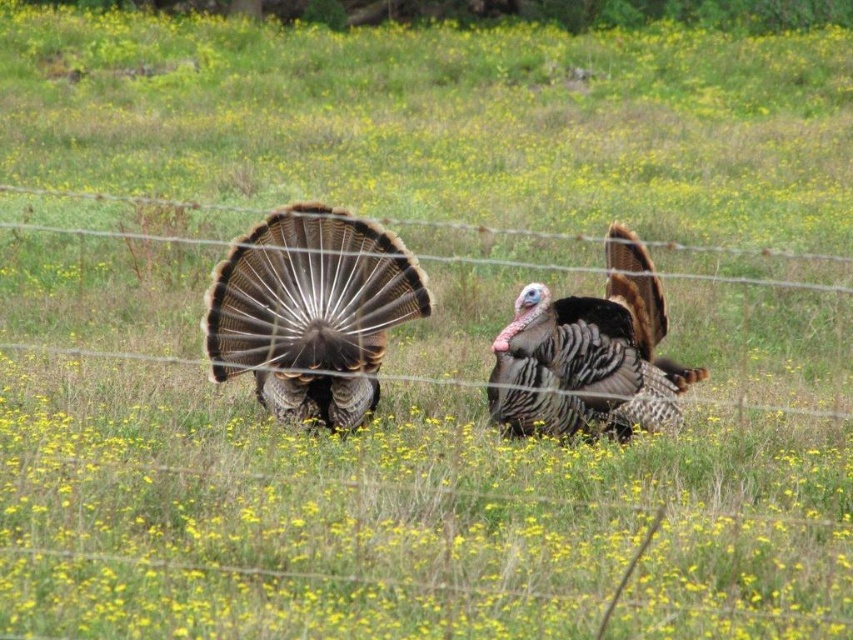
Question: Among these objects, which one is nearest to the camera?

Choices:
 (A) speckled feathered turkey at center
 (B) feathered brown turkey at center

Answer: (B)

Question: Does feathered brown turkey at center appear on the right side of speckled feathered turkey at center?

Choices:
 (A) no
 (B) yes

Answer: (A)

Question: Is feathered brown turkey at center to the left of speckled feathered turkey at center from the viewer's perspective?

Choices:
 (A) no
 (B) yes

Answer: (B)

Question: Which point is farther to the camera?

Choices:
 (A) speckled feathered turkey at center
 (B) feathered brown turkey at center

Answer: (A)

Question: Which point is farther from the camera taking this photo?

Choices:
 (A) (656, 301)
 (B) (241, 314)

Answer: (A)

Question: Is feathered brown turkey at center to the right of speckled feathered turkey at center from the viewer's perspective?

Choices:
 (A) yes
 (B) no

Answer: (B)